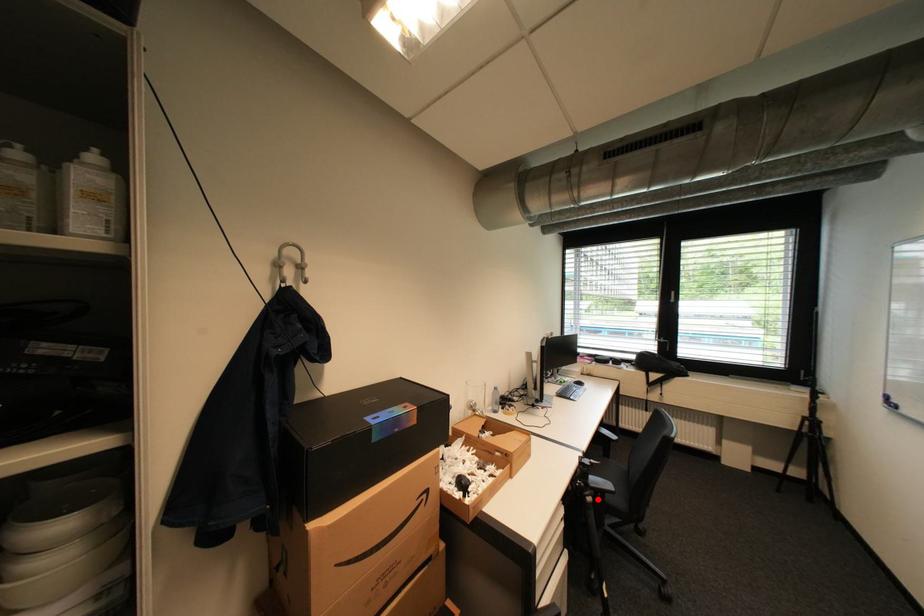
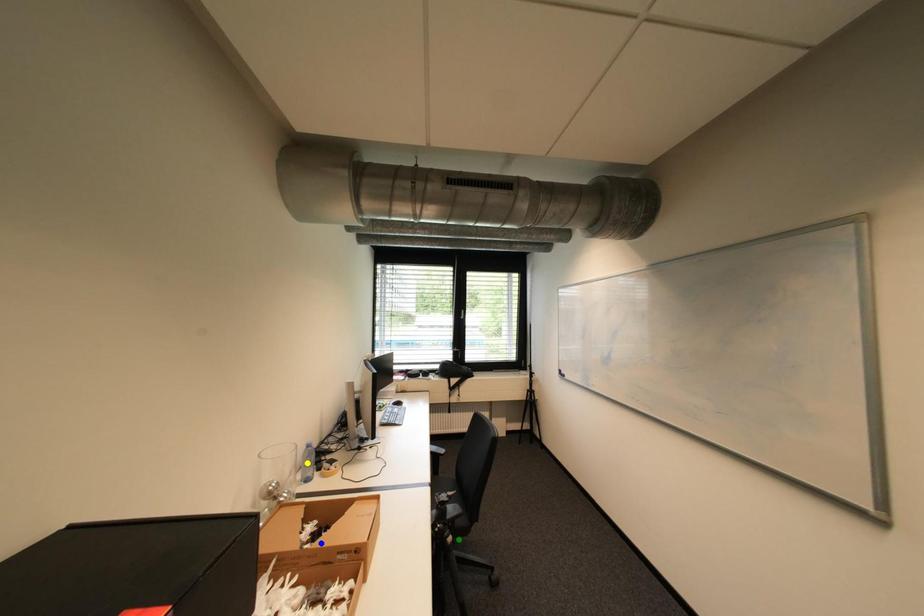
Question: I am providing you with two images of the same scene from different viewpoints. A red point is marked on the first image. You are given multiple points on the second image. Which spot in image 2 lines up with the point in image 1?

Choices:
 (A) yellow point
 (B) blue point
 (C) green point

Answer: (C)